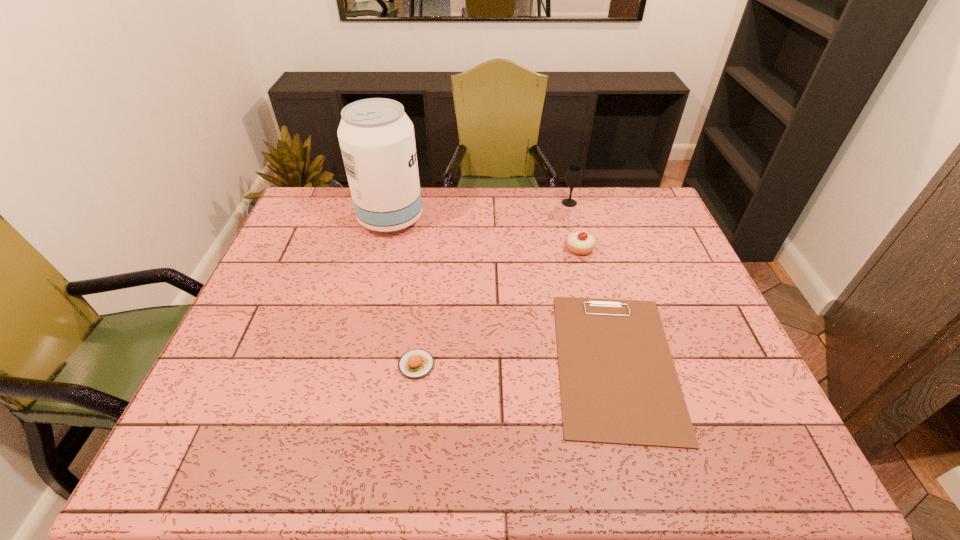
Where is `vacant point at the near right corner`? vacant point at the near right corner is located at coordinates (774, 471).

Find the location of a particular element. Image resolution: width=960 pixels, height=540 pixels. vacant space in between the food and the fourth shortest object is located at coordinates (492, 284).

The width and height of the screenshot is (960, 540). I want to click on free space between the fourth shortest object and the second shortest object, so click(x=492, y=284).

The height and width of the screenshot is (540, 960). What are the coordinates of `free spot between the clipboard and the tallest object` in the screenshot? It's located at (503, 291).

Image resolution: width=960 pixels, height=540 pixels. Find the location of `vacant point located between the pastry and the fourth shortest object`. vacant point located between the pastry and the fourth shortest object is located at coordinates (574, 226).

In order to click on vacant area that lies between the food and the wineglass in this screenshot , I will do `click(492, 284)`.

Find the location of a particular element. The image size is (960, 540). free space between the pastry and the food is located at coordinates (498, 306).

The image size is (960, 540). Find the location of `free spot between the alcohol and the shortest object`. free spot between the alcohol and the shortest object is located at coordinates (503, 291).

Locate an element on the screen. empty location between the pastry and the alcohol is located at coordinates (486, 234).

You are a GUI agent. You are given a task and a screenshot of the screen. Output one action in this format:
    pyautogui.click(x=<x>, y=<y>)
    Task: Click on the free point between the alcohol and the food
    This screenshot has width=960, height=540.
    Given the screenshot: What is the action you would take?
    pyautogui.click(x=403, y=292)